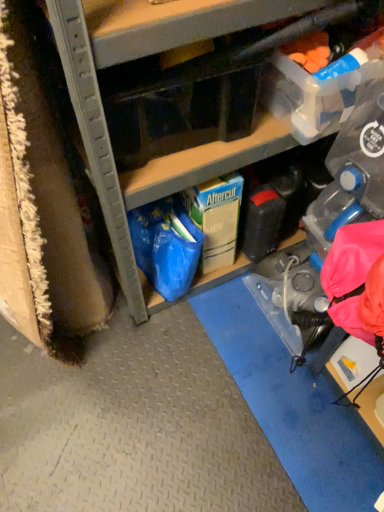
The width and height of the screenshot is (384, 512). Find the location of `transparent plastic storage box at upper center, which is counted as the first storage box, starting from the front`. transparent plastic storage box at upper center, which is counted as the first storage box, starting from the front is located at coordinates (181, 106).

Is translucent plastic storage box at upper right, the 2th storage box when ordered from back to front, taller than matte cardboard box at center?

Incorrect, the height of translucent plastic storage box at upper right, the 2th storage box when ordered from back to front, is not larger of that of matte cardboard box at center.

Could you tell me if translucent plastic storage box at upper right, the 2th storage box when ordered from back to front, is turned towards matte cardboard box at center?

No, translucent plastic storage box at upper right, the 2th storage box when ordered from back to front, is not aimed at matte cardboard box at center.

Looking at this image, is translucent plastic storage box at upper right, arranged as the second storage box when viewed from the front, thinner than matte cardboard box at center?

Yes, translucent plastic storage box at upper right, arranged as the second storage box when viewed from the front, is thinner than matte cardboard box at center.

Consider the image. Is translucent plastic storage box at upper right, arranged as the second storage box when viewed from the front, thinner than transparent plastic storage box at upper center, the third storage box in the back-to-front sequence?

Indeed, translucent plastic storage box at upper right, arranged as the second storage box when viewed from the front, has a lesser width compared to transparent plastic storage box at upper center, the third storage box in the back-to-front sequence.

From the image's perspective, which is above, translucent plastic storage box at upper right, the 2th storage box when ordered from back to front, or transparent plastic storage box at upper center, the third storage box in the back-to-front sequence?

translucent plastic storage box at upper right, the 2th storage box when ordered from back to front, appears higher in the image.

Is translucent plastic storage box at upper right, arranged as the second storage box when viewed from the front, not near transparent plastic storage box at upper center, the third storage box in the back-to-front sequence?

That's not correct — translucent plastic storage box at upper right, arranged as the second storage box when viewed from the front, is a little close to transparent plastic storage box at upper center, the third storage box in the back-to-front sequence.

Does translucent plastic storage box at upper right, arranged as the second storage box when viewed from the front, have a lesser height compared to transparent plastic storage box at upper center, which is counted as the first storage box, starting from the front?

Yes, translucent plastic storage box at upper right, arranged as the second storage box when viewed from the front, is shorter than transparent plastic storage box at upper center, which is counted as the first storage box, starting from the front.

Between point (235, 79) and point (200, 268), which one is positioned behind?

The point (200, 268) is farther from the camera.

From a real-world perspective, is transparent plastic storage box at upper center, which is counted as the first storage box, starting from the front, over green cardboard box at center, the third storage box from the front?

Indeed, from a real-world perspective, transparent plastic storage box at upper center, which is counted as the first storage box, starting from the front, stands above green cardboard box at center, the third storage box from the front.

Are transparent plastic storage box at upper center, the third storage box in the back-to-front sequence, and green cardboard box at center, the third storage box from the front, beside each other?

No, transparent plastic storage box at upper center, the third storage box in the back-to-front sequence, is not touching green cardboard box at center, the third storage box from the front.

Looking at this image, is green cardboard box at center, the first storage box positioned from the back, oriented away from transparent plastic storage box at upper center, which is counted as the first storage box, starting from the front?

No, green cardboard box at center, the first storage box positioned from the back,'s orientation is not away from transparent plastic storage box at upper center, which is counted as the first storage box, starting from the front.

You are a GUI agent. You are given a task and a screenshot of the screen. Output one action in this format:
    pyautogui.click(x=<x>, y=<y>)
    Task: Click on the storage box that is the 2nd one when counting forward from the green cardboard box at center, the first storage box positioned from the back
    
    Given the screenshot: What is the action you would take?
    pyautogui.click(x=181, y=106)

Can you confirm if green cardboard box at center, the first storage box positioned from the back, is positioned to the left of transparent plastic storage box at upper center, which is counted as the first storage box, starting from the front?

Incorrect, green cardboard box at center, the first storage box positioned from the back, is not on the left side of transparent plastic storage box at upper center, which is counted as the first storage box, starting from the front.

From the image's perspective, is green cardboard box at center, the third storage box from the front, above transparent plastic storage box at upper center, the third storage box in the back-to-front sequence?

No.

From a real-world perspective, relative to matte cardboard box at center, is transparent plastic storage box at upper center, the third storage box in the back-to-front sequence, vertically above or below?

transparent plastic storage box at upper center, the third storage box in the back-to-front sequence, is above matte cardboard box at center.

Which is behind, point (120, 75) or point (124, 69)?

The point (124, 69) is farther.

Considering the relative sizes of transparent plastic storage box at upper center, which is counted as the first storage box, starting from the front, and matte cardboard box at center in the image provided, is transparent plastic storage box at upper center, which is counted as the first storage box, starting from the front, shorter than matte cardboard box at center?

Indeed, transparent plastic storage box at upper center, which is counted as the first storage box, starting from the front, has a lesser height compared to matte cardboard box at center.

Is transparent plastic storage box at upper center, the third storage box in the back-to-front sequence, beside matte cardboard box at center?

Yes, transparent plastic storage box at upper center, the third storage box in the back-to-front sequence, and matte cardboard box at center clearly make contact.

From the image's perspective, who appears lower, matte cardboard box at center or translucent plastic storage box at upper right, the 2th storage box when ordered from back to front?

translucent plastic storage box at upper right, the 2th storage box when ordered from back to front.

Who is smaller, matte cardboard box at center or translucent plastic storage box at upper right, arranged as the second storage box when viewed from the front?

With smaller size is translucent plastic storage box at upper right, arranged as the second storage box when viewed from the front.

From a real-world perspective, is matte cardboard box at center under translucent plastic storage box at upper right, the 2th storage box when ordered from back to front?

Correct, in the physical world, matte cardboard box at center is lower than translucent plastic storage box at upper right, the 2th storage box when ordered from back to front.

Is transparent plastic storage box at upper center, the third storage box in the back-to-front sequence, surrounding translucent plastic storage box at upper right, arranged as the second storage box when viewed from the front?

No, translucent plastic storage box at upper right, arranged as the second storage box when viewed from the front, is not inside transparent plastic storage box at upper center, the third storage box in the back-to-front sequence.

Is transparent plastic storage box at upper center, which is counted as the first storage box, starting from the front, turned away from translucent plastic storage box at upper right, arranged as the second storage box when viewed from the front?

No.

Is transparent plastic storage box at upper center, the third storage box in the back-to-front sequence, bigger than translucent plastic storage box at upper right, the 2th storage box when ordered from back to front?

Yes.

Image resolution: width=384 pixels, height=512 pixels. Find the location of `the 1st storage box behind the transparent plastic storage box at upper center, which is counted as the first storage box, starting from the front, starting your count from the anchor`. the 1st storage box behind the transparent plastic storage box at upper center, which is counted as the first storage box, starting from the front, starting your count from the anchor is located at coordinates (320, 91).

At what (x,y) coordinates should I click in order to perform the action: click on cabinetry that appears below the translucent plastic storage box at upper right, the 2th storage box when ordered from back to front (from a real-world perspective). Please return your answer as a coordinate pair (x, y). Looking at the image, I should click on (173, 89).

Which storage box is the 2nd one when counting from the right side of the transparent plastic storage box at upper center, the third storage box in the back-to-front sequence? Please provide its 2D coordinates.

[(320, 91)]

Looking at the image, which one is located closer to green cardboard box at center, the third storage box from the front, matte cardboard box at center or translucent plastic storage box at upper right, the 2th storage box when ordered from back to front?

Based on the image, matte cardboard box at center appears to be nearer to green cardboard box at center, the third storage box from the front.

When comparing their distances from matte cardboard box at center, does transparent plastic storage box at upper center, the third storage box in the back-to-front sequence, or green cardboard box at center, the third storage box from the front, seem closer?

Based on the image, transparent plastic storage box at upper center, the third storage box in the back-to-front sequence, appears to be nearer to matte cardboard box at center.

When comparing their distances from translucent plastic storage box at upper right, the 2th storage box when ordered from back to front, does green cardboard box at center, the third storage box from the front, or transparent plastic storage box at upper center, which is counted as the first storage box, starting from the front, seem further?

green cardboard box at center, the third storage box from the front, is positioned further to the anchor translucent plastic storage box at upper right, the 2th storage box when ordered from back to front.

Looking at this image, which object lies nearer to the anchor point green cardboard box at center, the third storage box from the front, translucent plastic storage box at upper right, the 2th storage box when ordered from back to front, or transparent plastic storage box at upper center, the third storage box in the back-to-front sequence?

transparent plastic storage box at upper center, the third storage box in the back-to-front sequence, is positioned closer to the anchor green cardboard box at center, the third storage box from the front.

Looking at this image, looking at the image, which one is located further to transparent plastic storage box at upper center, which is counted as the first storage box, starting from the front, translucent plastic storage box at upper right, arranged as the second storage box when viewed from the front, or matte cardboard box at center?

translucent plastic storage box at upper right, arranged as the second storage box when viewed from the front.

Which object lies further to the anchor point translucent plastic storage box at upper right, arranged as the second storage box when viewed from the front, transparent plastic storage box at upper center, which is counted as the first storage box, starting from the front, or matte cardboard box at center?

transparent plastic storage box at upper center, which is counted as the first storage box, starting from the front, is positioned further to the anchor translucent plastic storage box at upper right, arranged as the second storage box when viewed from the front.

When comparing their distances from transparent plastic storage box at upper center, which is counted as the first storage box, starting from the front, does matte cardboard box at center or green cardboard box at center, the third storage box from the front, seem closer?

matte cardboard box at center is closer to transparent plastic storage box at upper center, which is counted as the first storage box, starting from the front.

Based on their spatial positions, is green cardboard box at center, the third storage box from the front, or translucent plastic storage box at upper right, arranged as the second storage box when viewed from the front, closer to transparent plastic storage box at upper center, which is counted as the first storage box, starting from the front?

translucent plastic storage box at upper right, arranged as the second storage box when viewed from the front.

Find the location of a particular element. The image size is (384, 512). cabinetry between transparent plastic storage box at upper center, the third storage box in the back-to-front sequence, and translucent plastic storage box at upper right, arranged as the second storage box when viewed from the front, from left to right is located at coordinates (173, 89).

The width and height of the screenshot is (384, 512). I want to click on storage box between transparent plastic storage box at upper center, the third storage box in the back-to-front sequence, and translucent plastic storage box at upper right, arranged as the second storage box when viewed from the front, so click(216, 218).